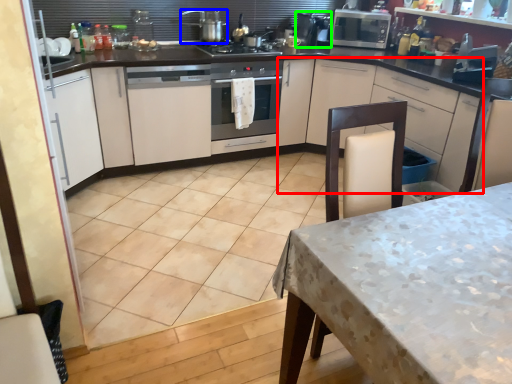
Question: Considering the real-world distances, which object is farthest from cabinetry (highlighted by a red box)? kitchen appliance (highlighted by a blue box) or appliance (highlighted by a green box)?

Choices:
 (A) kitchen appliance
 (B) appliance

Answer: (A)